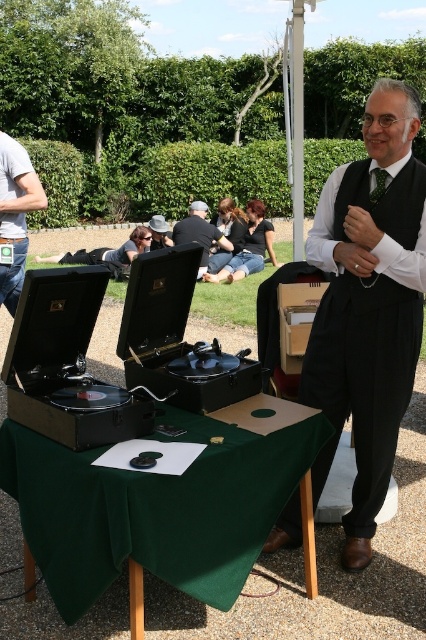
Question: Does black satin vest at center appear over dark gray suit at center?

Choices:
 (A) yes
 (B) no

Answer: (B)

Question: Which of the following is the closest to the observer?

Choices:
 (A) black satin vest at center
 (B) light blue t-shirt at left
 (C) dark gray suit at center

Answer: (A)

Question: Is light blue t-shirt at left further to the viewer compared to dark gray suit at center?

Choices:
 (A) no
 (B) yes

Answer: (A)

Question: Observing the image, what is the correct spatial positioning of green fabric table at center in reference to black satin vest at center?

Choices:
 (A) below
 (B) above

Answer: (A)

Question: Which object is positioned farthest from the light blue t-shirt at left?

Choices:
 (A) green fabric table at center
 (B) black satin vest at center

Answer: (A)

Question: Which point appears farthest from the camera in this image?

Choices:
 (A) (402, 109)
 (B) (183, 228)

Answer: (B)